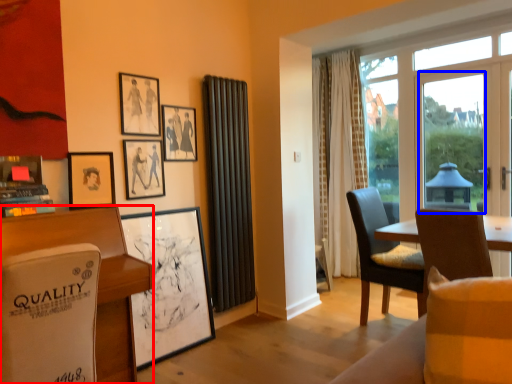
Question: Among these objects, which one is farthest to the camera, desk (highlighted by a red box) or window screen (highlighted by a blue box)?

Choices:
 (A) desk
 (B) window screen

Answer: (B)